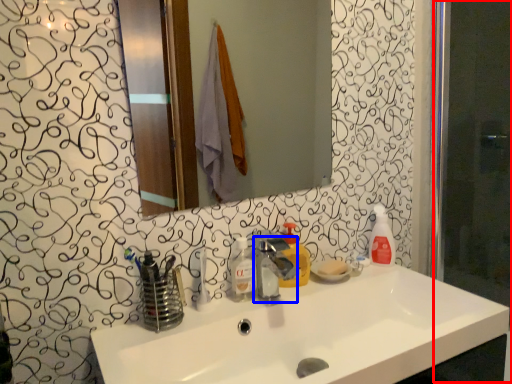
Question: Which of the following is the closest to the observer, screen door (highlighted by a red box) or tap (highlighted by a blue box)?

Choices:
 (A) screen door
 (B) tap

Answer: (B)